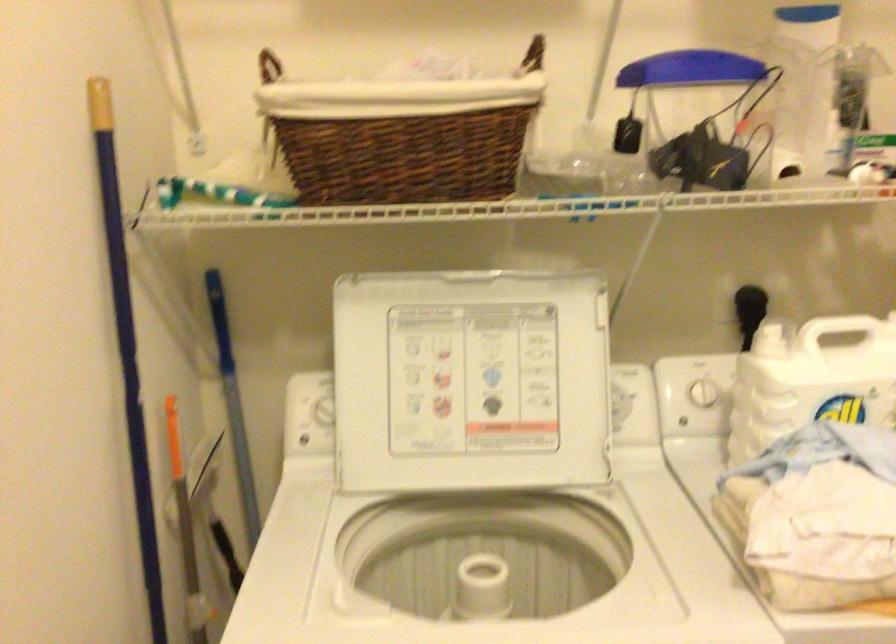
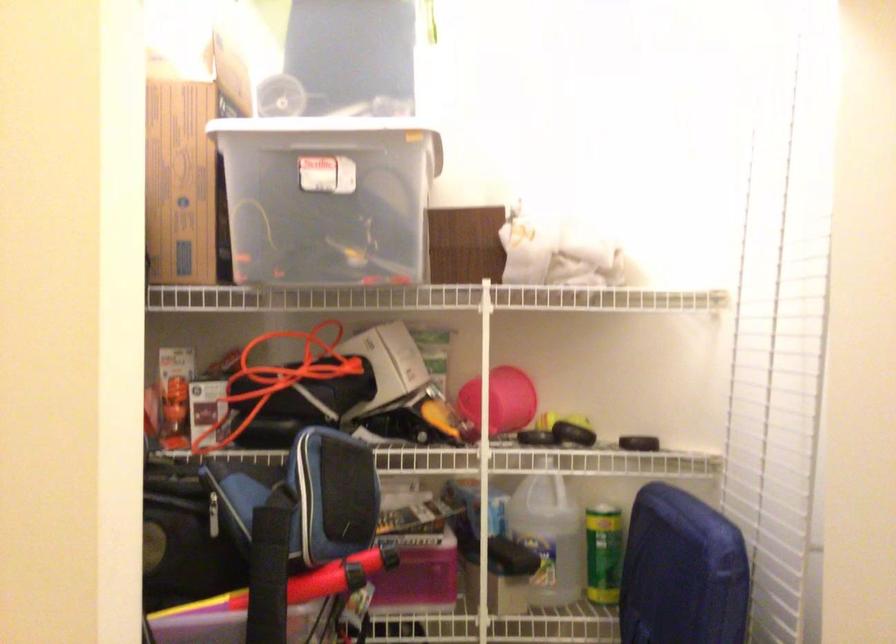
Question: The camera is either moving clockwise (left) or counter-clockwise (right) around the object. The first image is from the beginning of the video and the second image is from the end. Is the camera moving left or right when shooting the video?

Choices:
 (A) Left
 (B) Right

Answer: (A)